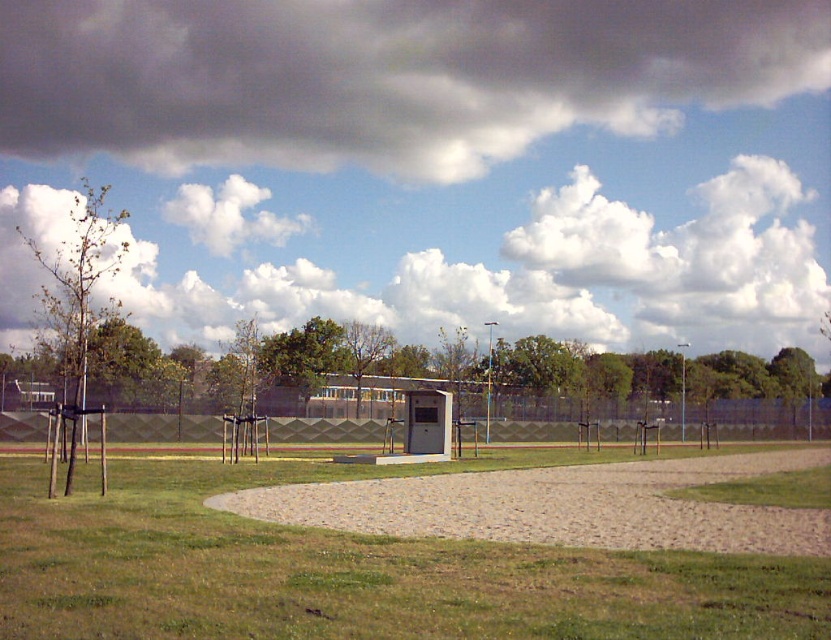
Question: Which of the following is the closest to the observer?

Choices:
 (A) green grass at center
 (B) brown gravel at center

Answer: (A)

Question: Is green grass at center below brown gravel at center?

Choices:
 (A) yes
 (B) no

Answer: (B)

Question: Does green grass at center have a greater width compared to brown gravel at center?

Choices:
 (A) no
 (B) yes

Answer: (A)

Question: Which of the following is the closest to the observer?

Choices:
 (A) brown gravel at center
 (B) green grass at center

Answer: (B)

Question: From the image, what is the correct spatial relationship of green grass at center in relation to brown gravel at center?

Choices:
 (A) above
 (B) below

Answer: (A)

Question: Which point appears farthest from the camera in this image?

Choices:
 (A) (347, 509)
 (B) (146, 586)

Answer: (A)